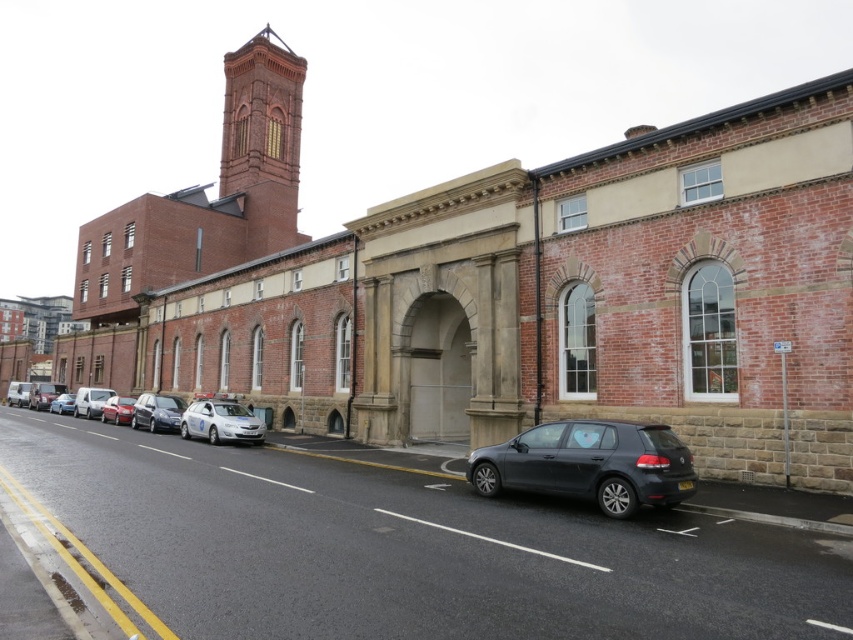
Consider the image. Between silver metallic hatchback at center and shiny silver sedan at center-left, which one is positioned lower?

shiny silver sedan at center-left is lower down.

Can you confirm if silver metallic hatchback at center is smaller than shiny silver sedan at center-left?

Yes.

Is point (212, 442) farther from viewer compared to point (155, 397)?

No.

Find the location of `silver metallic hatchback at center`. silver metallic hatchback at center is located at coordinates (221, 422).

Can you confirm if shiny silver sedan at center-left is taller than silver metallic car at center-left?

Indeed, shiny silver sedan at center-left has a greater height compared to silver metallic car at center-left.

Can you confirm if shiny silver sedan at center-left is positioned to the right of silver metallic car at center-left?

Correct, you'll find shiny silver sedan at center-left to the right of silver metallic car at center-left.

Between point (178, 422) and point (51, 408), which one is positioned in front?

Positioned in front is point (178, 422).

I want to click on shiny silver sedan at center-left, so click(157, 412).

Does matte gray hatchback at lower center appear over matte silver van at left?

Yes, matte gray hatchback at lower center is above matte silver van at left.

Describe the element at coordinates (589, 465) in the screenshot. I see `matte gray hatchback at lower center` at that location.

Is point (596, 426) closer to viewer compared to point (91, 408)?

Yes, it is.

This screenshot has height=640, width=853. Find the location of `matte gray hatchback at lower center`. matte gray hatchback at lower center is located at coordinates click(x=589, y=465).